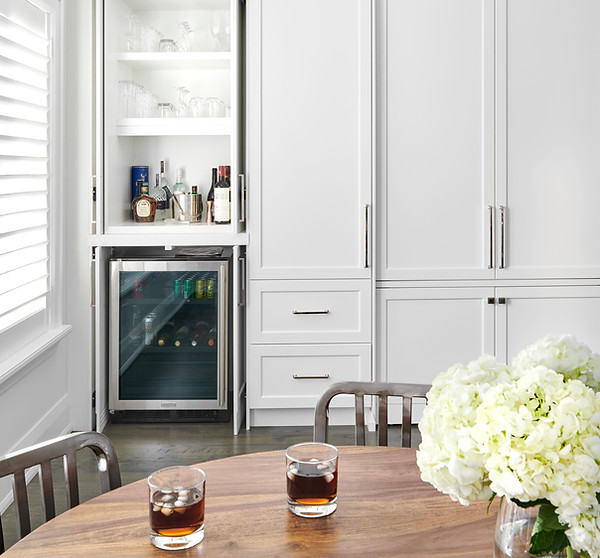
You are a GUI agent. You are given a task and a screenshot of the screen. Output one action in this format:
    pyautogui.click(x=<x>, y=<y>)
    Task: Click on the vase
    The height and width of the screenshot is (558, 600).
    Given the screenshot: What is the action you would take?
    pyautogui.click(x=514, y=538)